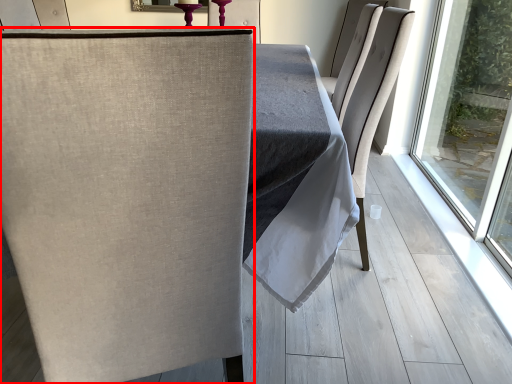
Question: From the image's perspective, where is chair (annotated by the red box) located in relation to chair in the image?

Choices:
 (A) above
 (B) below

Answer: (B)